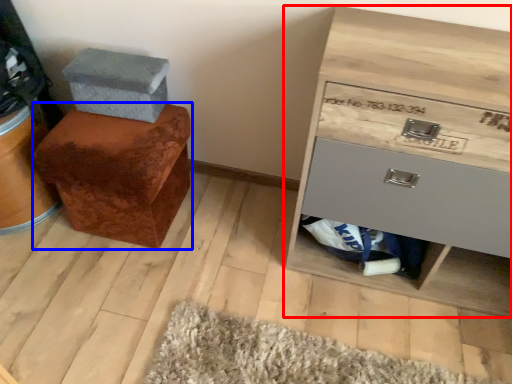
Question: Which object is closer to the camera taking this photo, chest of drawers (highlighted by a red box) or furniture (highlighted by a blue box)?

Choices:
 (A) chest of drawers
 (B) furniture

Answer: (A)